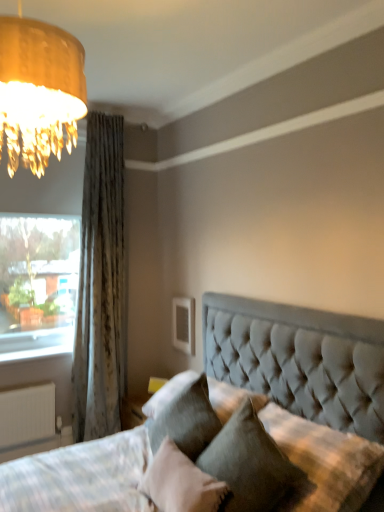
Question: Is velvet gray pillow at lower center, which is the 2th pillow from right to left, a part of yellow fabric table lamp at lower center?

Choices:
 (A) yes
 (B) no

Answer: (B)

Question: Is yellow fabric table lamp at lower center behind velvet gray pillow at lower center, which is the 2th pillow from right to left?

Choices:
 (A) yes
 (B) no

Answer: (A)

Question: Is yellow fabric table lamp at lower center taller than velvet gray pillow at lower center, which ranks as the 1th pillow in left-to-right order?

Choices:
 (A) yes
 (B) no

Answer: (B)

Question: Can you confirm if yellow fabric table lamp at lower center is positioned to the left of velvet gray pillow at lower center, which ranks as the 1th pillow in left-to-right order?

Choices:
 (A) no
 (B) yes

Answer: (B)

Question: From the image's perspective, is yellow fabric table lamp at lower center under velvet gray pillow at lower center, which ranks as the 1th pillow in left-to-right order?

Choices:
 (A) no
 (B) yes

Answer: (B)

Question: Considering the positions of velvet gray pillow at lower center, which ranks as the 1th pillow in left-to-right order, and textured gray curtain at left in the image, is velvet gray pillow at lower center, which ranks as the 1th pillow in left-to-right order, wider or thinner than textured gray curtain at left?

Choices:
 (A) wide
 (B) thin

Answer: (B)

Question: From their relative heights in the image, would you say velvet gray pillow at lower center, which ranks as the 1th pillow in left-to-right order, is taller or shorter than textured gray curtain at left?

Choices:
 (A) tall
 (B) short

Answer: (B)

Question: Considering the positions of point (200, 506) and point (107, 336), is point (200, 506) closer or farther from the camera than point (107, 336)?

Choices:
 (A) farther
 (B) closer

Answer: (B)

Question: Is velvet gray pillow at lower center, which is the 2th pillow from right to left, bigger or smaller than textured gray curtain at left?

Choices:
 (A) small
 (B) big

Answer: (A)

Question: From the image's perspective, relative to textured gray curtain at left, is tufted fabric pillow at center, the second pillow from the left, above or below?

Choices:
 (A) below
 (B) above

Answer: (A)

Question: From a real-world perspective, is tufted fabric pillow at center, positioned as the 1th pillow in right-to-left order, positioned above or below textured gray curtain at left?

Choices:
 (A) above
 (B) below

Answer: (B)

Question: Is tufted fabric pillow at center, positioned as the 1th pillow in right-to-left order, taller or shorter than textured gray curtain at left?

Choices:
 (A) short
 (B) tall

Answer: (A)

Question: In the image, is tufted fabric pillow at center, the second pillow from the left, positioned in front of or behind textured gray curtain at left?

Choices:
 (A) front
 (B) behind

Answer: (A)

Question: Considering the positions of white matte radiator at lower left and yellow fabric table lamp at lower center in the image, is white matte radiator at lower left taller or shorter than yellow fabric table lamp at lower center?

Choices:
 (A) tall
 (B) short

Answer: (A)

Question: From the image's perspective, relative to yellow fabric table lamp at lower center, is white matte radiator at lower left above or below?

Choices:
 (A) above
 (B) below

Answer: (B)